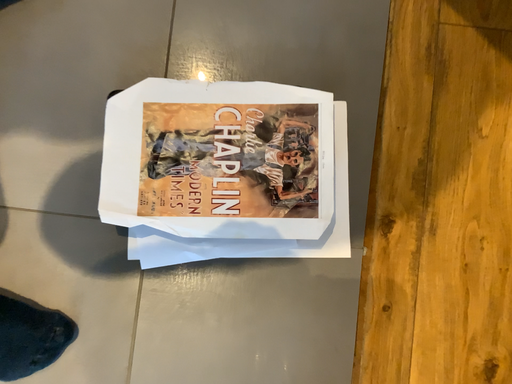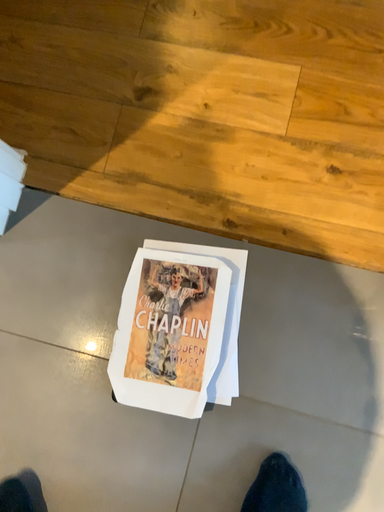
Question: How did the camera likely rotate when shooting the video?

Choices:
 (A) rotated upward
 (B) rotated downward

Answer: (A)